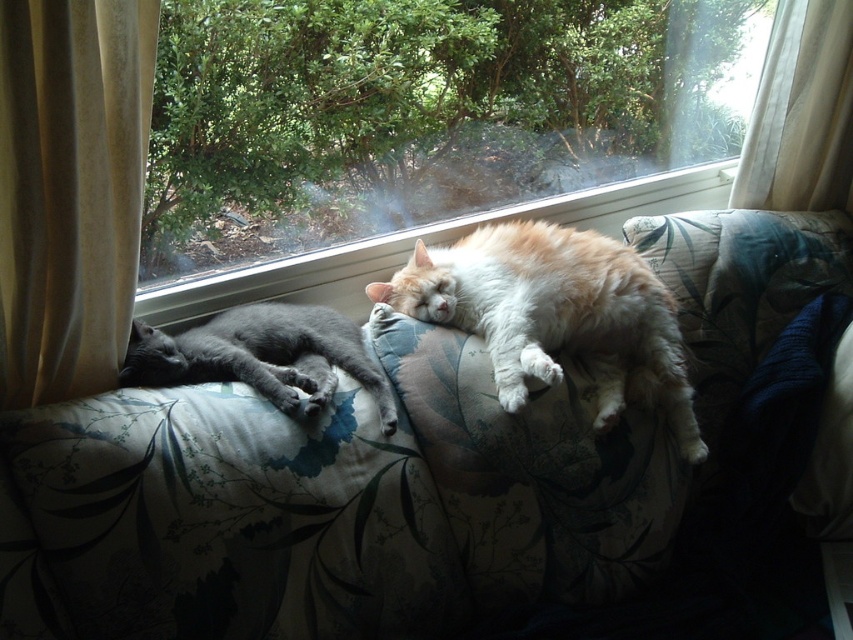
Does transparent glass window at upper center have a greater width compared to velvet beige curtain at left?

Yes.

Is transparent glass window at upper center further to camera compared to velvet beige curtain at left?

Yes.

The width and height of the screenshot is (853, 640). I want to click on transparent glass window at upper center, so click(421, 113).

Where is `transparent glass window at upper center`? The image size is (853, 640). transparent glass window at upper center is located at coordinates (421, 113).

Does velvet beige curtain at left appear on the left side of fluffy orange cat at center?

Yes, velvet beige curtain at left is to the left of fluffy orange cat at center.

Which is below, velvet beige curtain at left or fluffy orange cat at center?

Positioned lower is fluffy orange cat at center.

This screenshot has width=853, height=640. I want to click on velvet beige curtain at left, so click(70, 189).

You are a GUI agent. You are given a task and a screenshot of the screen. Output one action in this format:
    pyautogui.click(x=<x>, y=<y>)
    Task: Click on the velvet beige curtain at left
    
    Given the screenshot: What is the action you would take?
    pyautogui.click(x=70, y=189)

Which of these two, floral fabric couch at center or matte gray cat at left, stands shorter?

With less height is matte gray cat at left.

Is point (338, 518) more distant than point (242, 348)?

That is False.

What are the coordinates of `floral fabric couch at center` in the screenshot? It's located at (325, 506).